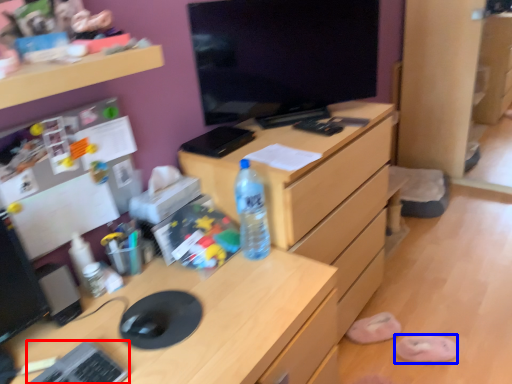
Question: Which point is closer to the camera, keyboard (highlighted by a red box) or slipper (highlighted by a blue box)?

Choices:
 (A) keyboard
 (B) slipper

Answer: (A)